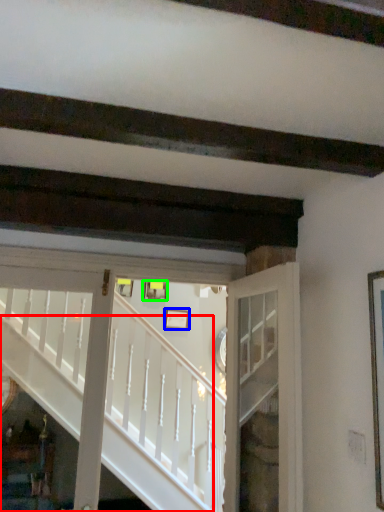
Question: Estimate the real-world distances between objects in this image. Which object is closer to stairs (highlighted by a red box), picture frame (highlighted by a blue box) or picture frame (highlighted by a green box)?

Choices:
 (A) picture frame
 (B) picture frame

Answer: (B)